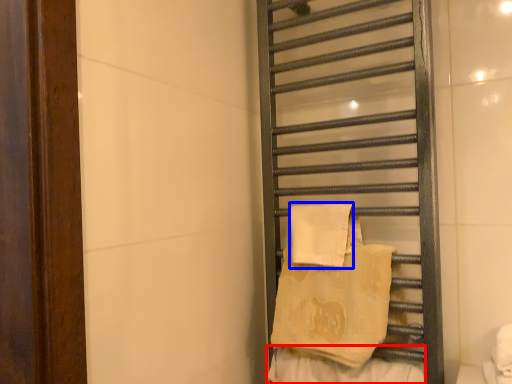
Question: Which point is closer to the camera, material (highlighted by a red box) or beach towel (highlighted by a blue box)?

Choices:
 (A) material
 (B) beach towel

Answer: (A)